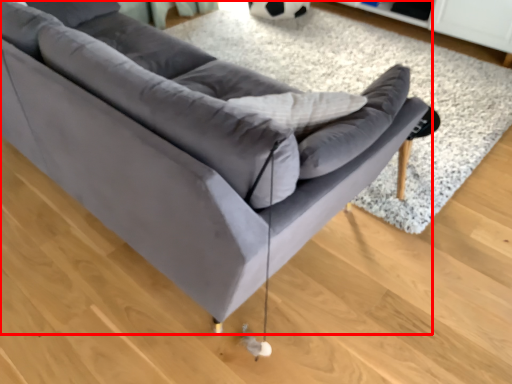
Question: From the image's perspective, where is studio couch (annotated by the red box) located relative to mat?

Choices:
 (A) above
 (B) below

Answer: (B)